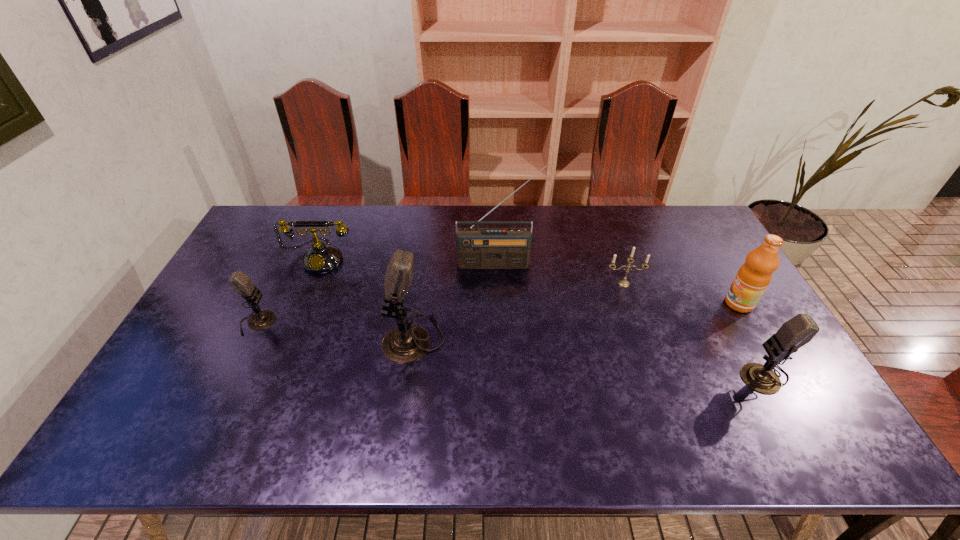
The height and width of the screenshot is (540, 960). I want to click on spot to insert another microphone for uniform distribution, so click(x=583, y=356).